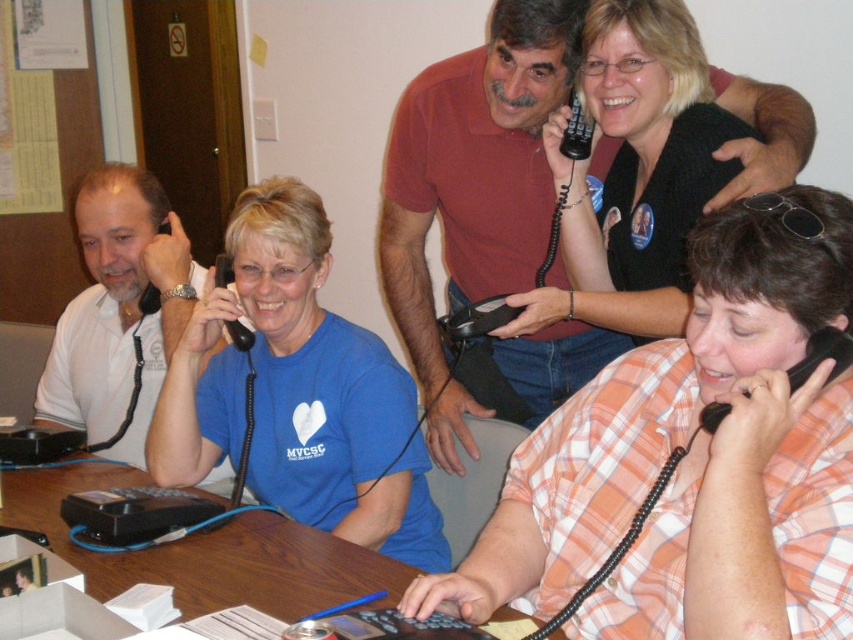
Which is more to the right, matte red shirt at upper center or blue matte shirt at center?

matte red shirt at upper center is more to the right.

Does matte red shirt at upper center have a lesser height compared to blue matte shirt at center?

In fact, matte red shirt at upper center may be taller than blue matte shirt at center.

Is point (744, 113) less distant than point (300, 304)?

Yes.

Find the location of a particular element. matte red shirt at upper center is located at coordinates (491, 225).

Between orange plaid shirt at lower right and brown wooden table at center, which one has more height?

orange plaid shirt at lower right is taller.

Between point (802, 476) and point (123, 484), which one is positioned behind?

Positioned behind is point (123, 484).

Who is more forward, (x=746, y=256) or (x=302, y=612)?

Positioned in front is point (x=746, y=256).

This screenshot has width=853, height=640. In order to click on orange plaid shirt at lower right in this screenshot , I will do `click(694, 460)`.

Is matte red shirt at upper center closer to the viewer compared to white matte shirt at left?

Yes, matte red shirt at upper center is closer to the viewer.

Image resolution: width=853 pixels, height=640 pixels. Find the location of `matte red shirt at upper center`. matte red shirt at upper center is located at coordinates (491, 225).